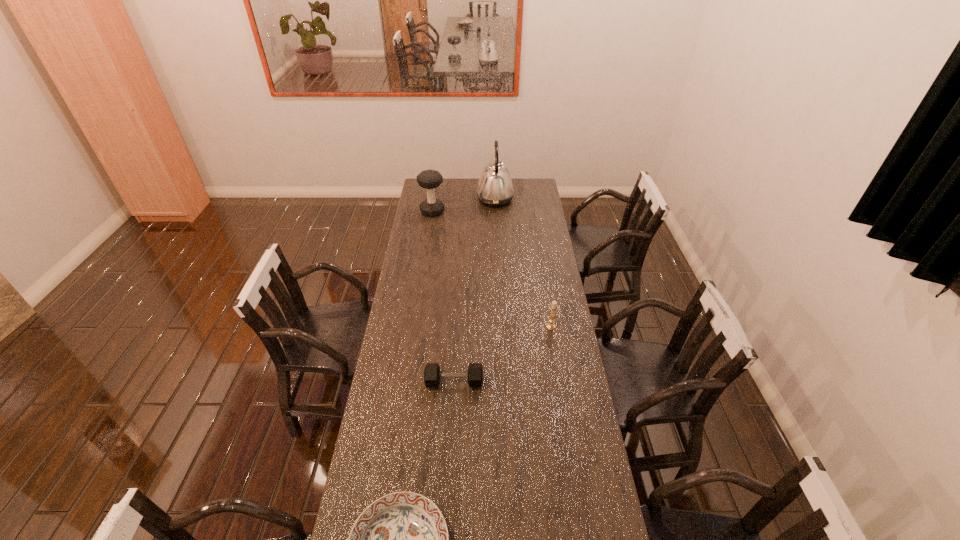
Identify the location of free point between the farther dumbbell and the nearer dumbbell. Image resolution: width=960 pixels, height=540 pixels. (444, 297).

You are a GUI agent. You are given a task and a screenshot of the screen. Output one action in this format:
    pyautogui.click(x=<x>, y=<y>)
    Task: Click on the unoccupied area between the tallest object and the farther dumbbell
    The height and width of the screenshot is (540, 960).
    Given the screenshot: What is the action you would take?
    pyautogui.click(x=464, y=205)

You are a GUI agent. You are given a task and a screenshot of the screen. Output one action in this format:
    pyautogui.click(x=<x>, y=<y>)
    Task: Click on the vacant area that lies between the third shortest object and the farther dumbbell
    Image resolution: width=960 pixels, height=540 pixels.
    Given the screenshot: What is the action you would take?
    pyautogui.click(x=492, y=269)

Image resolution: width=960 pixels, height=540 pixels. In order to click on free spot between the third tallest object and the tallest object in this screenshot , I will do `click(523, 263)`.

Identify which object is located as the third nearest to the candle holder. Please provide its 2D coordinates. Your answer should be formatted as a tuple, i.e. [(x, y)], where the tuple contains the x and y coordinates of a point satisfying the conditions above.

[(495, 188)]

Locate an element on the screen. object identified as the fourth closest to the second shortest object is located at coordinates (495, 188).

Identify the location of free space in the image that satisfies the following two spatial constraints: 1. on the back side of the third tallest object; 2. from the spout of the tallest object. The height and width of the screenshot is (540, 960). (530, 199).